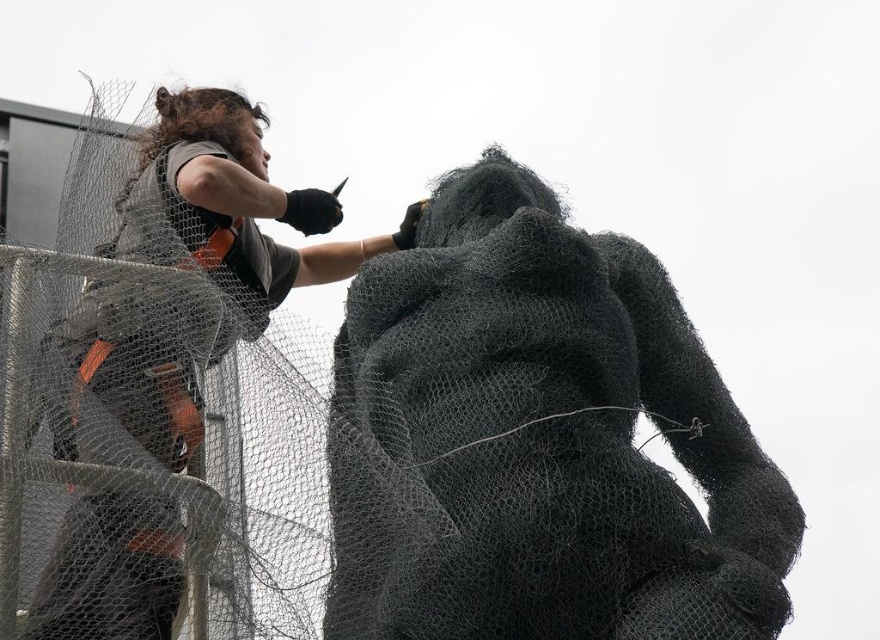
Question: Which point is closer to the camera?

Choices:
 (A) textured wire mesh gorilla at center
 (B) matte black shirt at upper left

Answer: (B)

Question: Is textured wire mesh gorilla at center above matte black shirt at upper left?

Choices:
 (A) no
 (B) yes

Answer: (A)

Question: Is textured wire mesh gorilla at center above matte black shirt at upper left?

Choices:
 (A) no
 (B) yes

Answer: (A)

Question: Among these points, which one is nearest to the camera?

Choices:
 (A) (539, 448)
 (B) (336, 214)

Answer: (A)

Question: Is textured wire mesh gorilla at center above matte black shirt at upper left?

Choices:
 (A) yes
 (B) no

Answer: (B)